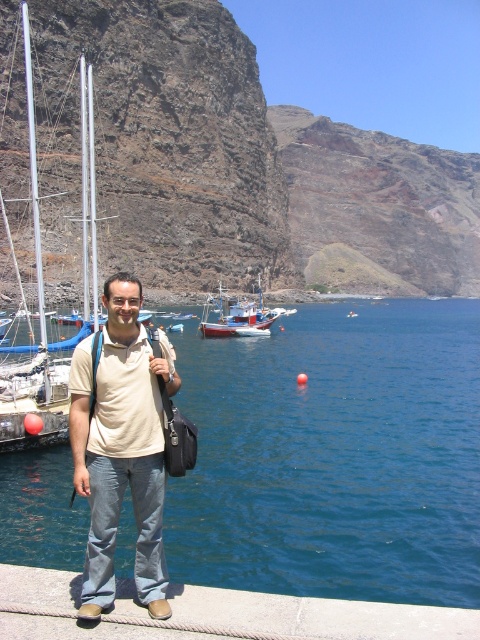
Looking at this image, you are a photographer trying to capture the entire scene of the concrete at lower center and the brushed metal boat at left in one shot. Based on their sizes, which object should you focus on first to ensure both fit in the frame?

The concrete at lower center has a smaller size compared to the brushed metal boat at left, so you should focus on the brushed metal boat at left first since it takes up more space in the frame, ensuring both objects are captured adequately.